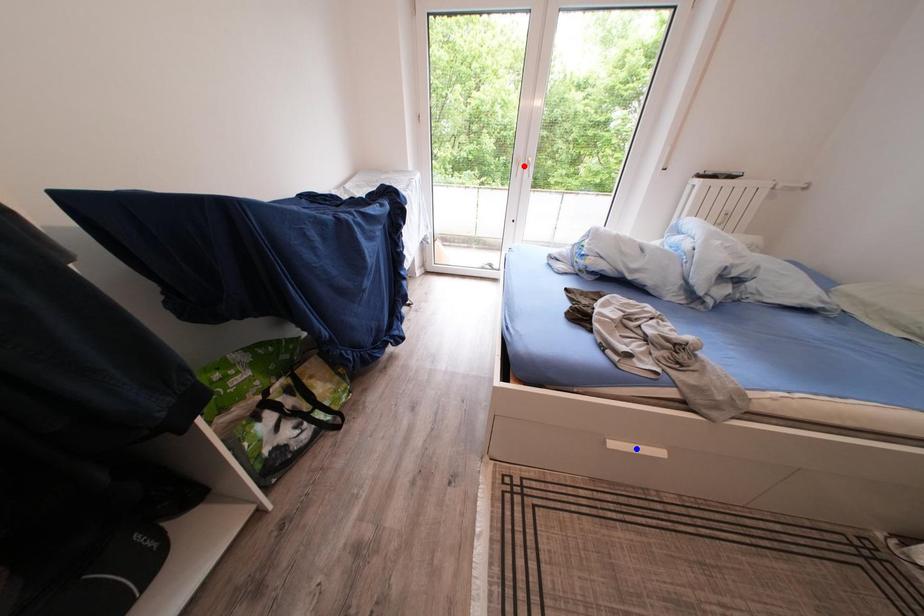
Question: In the image, two points are highlighted. Which point is nearer to the camera? Reply with the corresponding letter.

Choices:
 (A) blue point
 (B) red point

Answer: (A)